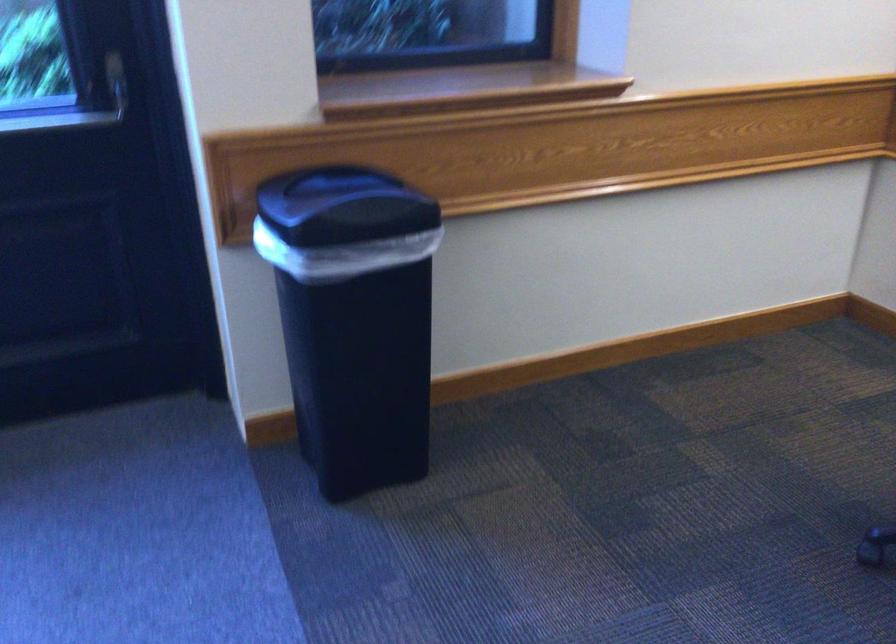
What do you see at coordinates (342, 205) in the screenshot? I see `the black trash can lid` at bounding box center [342, 205].